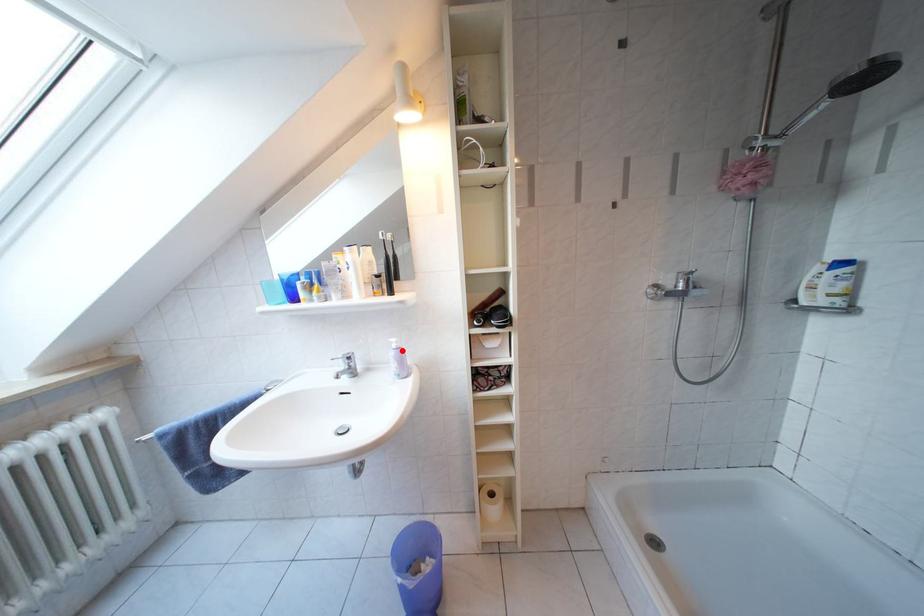
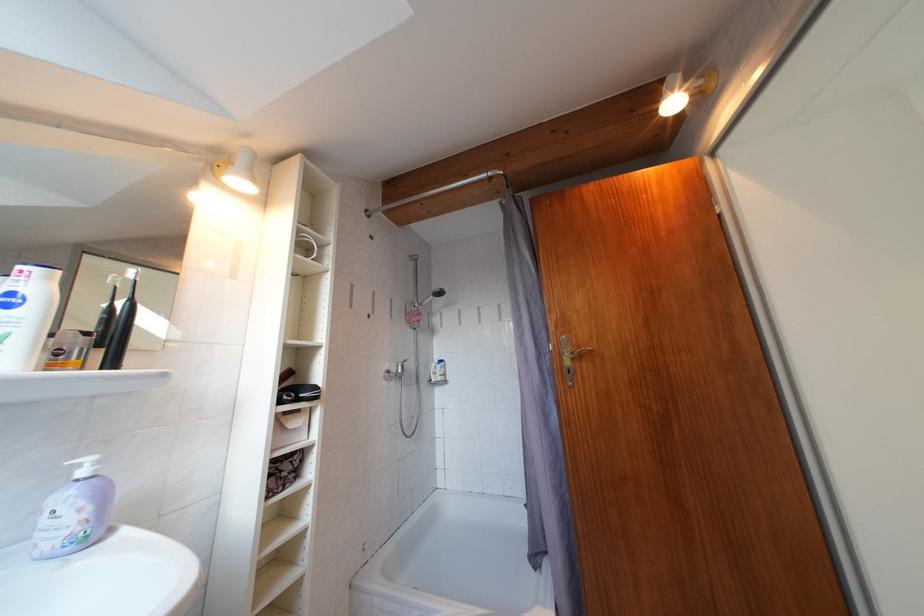
In the second image, find the point that corresponds to the highlighted location in the first image.

(92, 477)